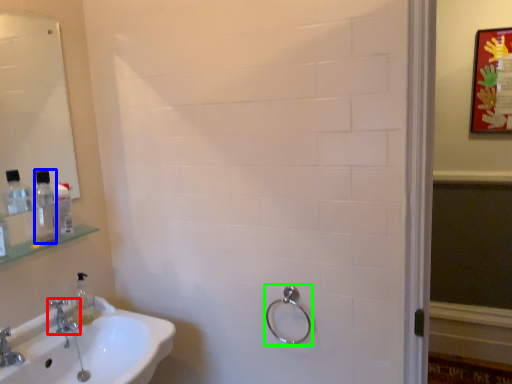
Question: Estimate the real-world distances between objects in this image. Which object is farther from tap (highlighted by a red box), mouthwash (highlighted by a blue box) or shower (highlighted by a green box)?

Choices:
 (A) mouthwash
 (B) shower

Answer: (B)